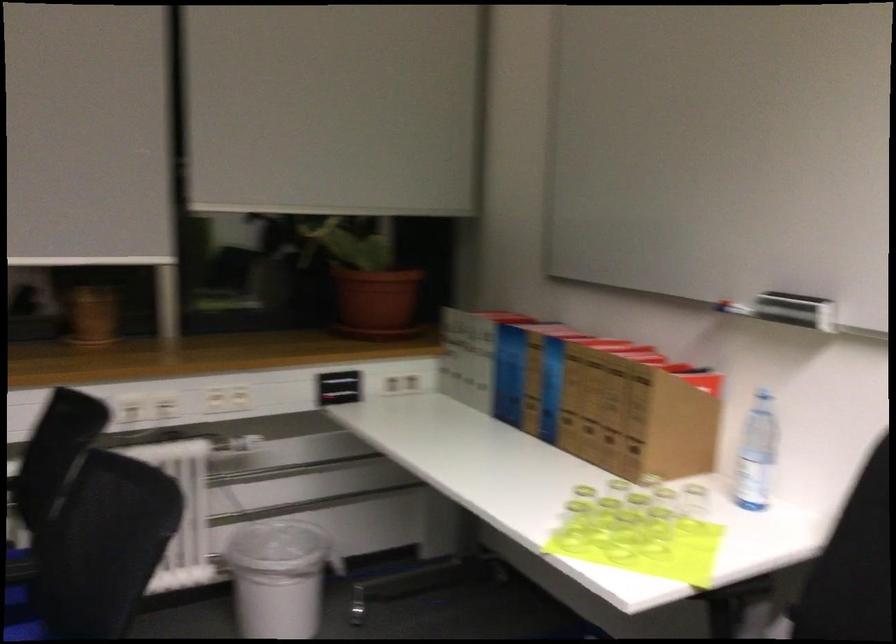
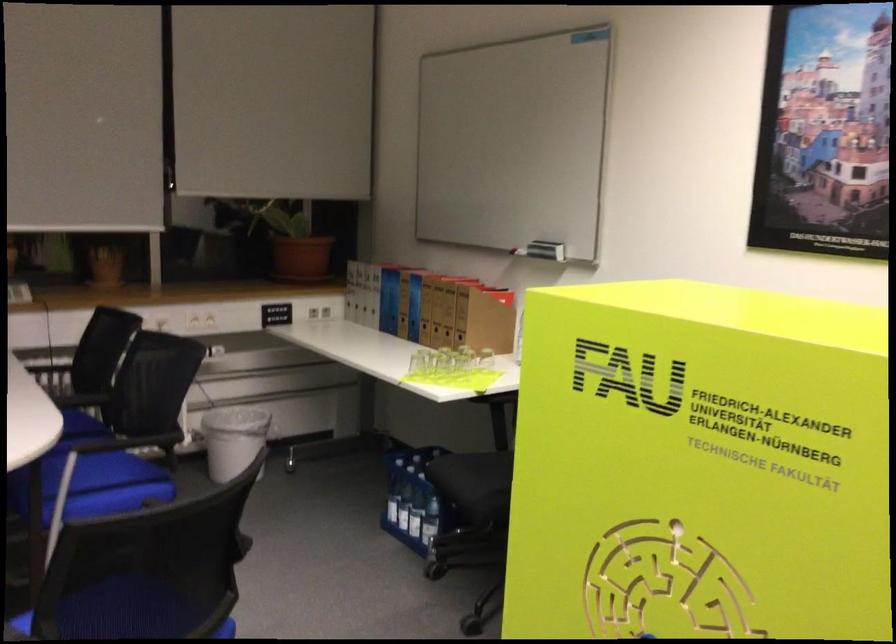
The point at (675, 494) is marked in the first image. Where is the corresponding point in the second image?

(485, 359)